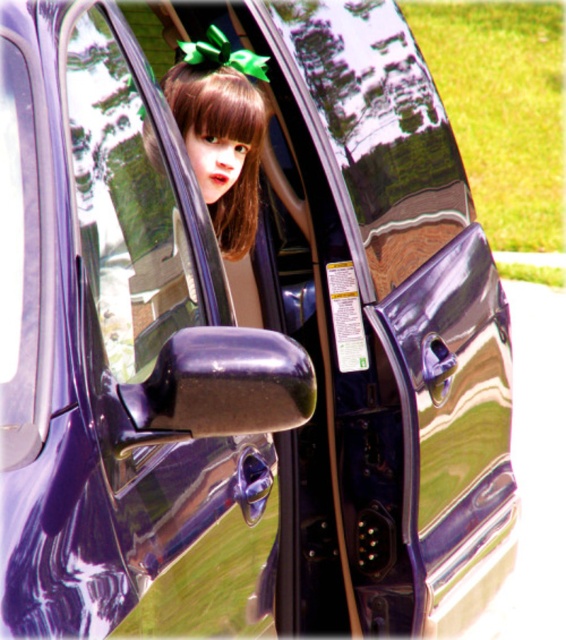
Question: In this image, where is transparent plastic car window at center located relative to matte brown hair at center?

Choices:
 (A) below
 (B) above

Answer: (A)

Question: Which object appears closest to the camera in this image?

Choices:
 (A) transparent plastic car window at center
 (B) matte brown hair at center

Answer: (A)

Question: Does transparent plastic car window at center have a larger size compared to matte brown hair at center?

Choices:
 (A) yes
 (B) no

Answer: (A)

Question: Is transparent plastic car window at center below matte brown hair at center?

Choices:
 (A) no
 (B) yes

Answer: (B)

Question: Among these objects, which one is farthest from the camera?

Choices:
 (A) transparent plastic car window at center
 (B) matte brown hair at center

Answer: (B)